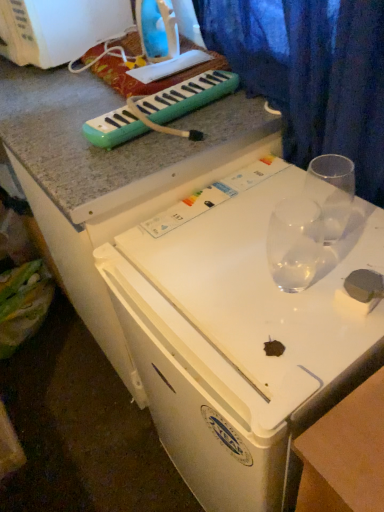
Question: From a real-world perspective, is white plastic washing machine at upper left, marked as the second appliance in a right-to-left arrangement, positioned above or below green plastic melodica at upper center?

Choices:
 (A) below
 (B) above

Answer: (B)

Question: In the image, is white plastic washing machine at upper left, which is the 1th appliance from left to right, positioned in front of or behind green plastic melodica at upper center?

Choices:
 (A) behind
 (B) front

Answer: (A)

Question: Which object is positioned closest to the green plastic melodica at upper center?

Choices:
 (A) clear glass martini glass at center, the 2th martini glass positioned from the right
 (B) transparent glass at upper right, the 2th martini glass viewed from the left
 (C) white plastic washing machine at upper left, which is the 1th appliance from left to right
 (D) matte plastic iron at upper center, which is the first appliance from right to left
 (E) blue fabric curtain at upper right

Answer: (E)

Question: Estimate the real-world distances between objects in this image. Which object is closer to the blue fabric curtain at upper right?

Choices:
 (A) clear glass martini glass at center, the 2th martini glass positioned from the right
 (B) transparent glass at upper right, which is the first martini glass in right-to-left order
 (C) green plastic melodica at upper center
 (D) white plastic washing machine at upper left, which is the 1th appliance from left to right
 (E) matte plastic iron at upper center, placed as the second appliance when sorted from left to right

Answer: (B)